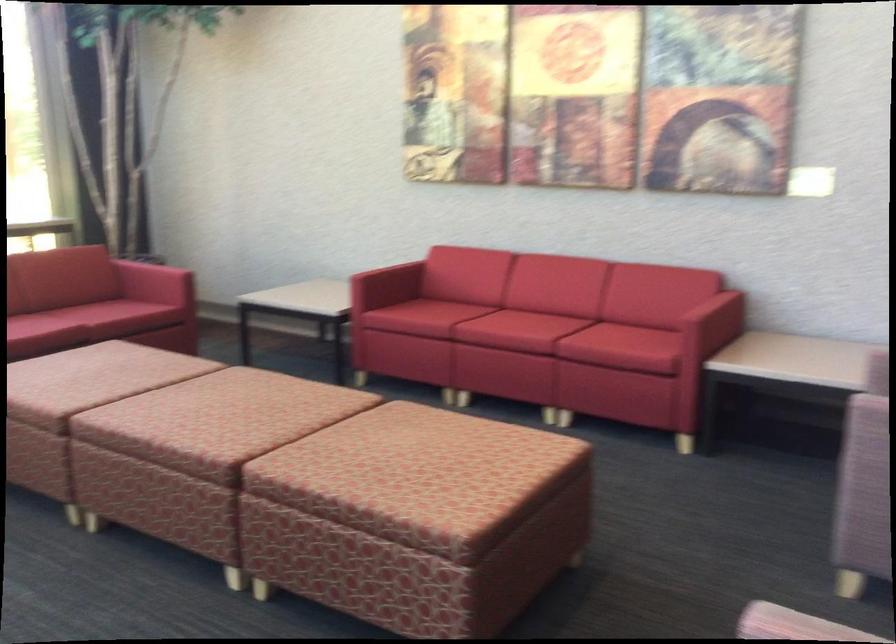
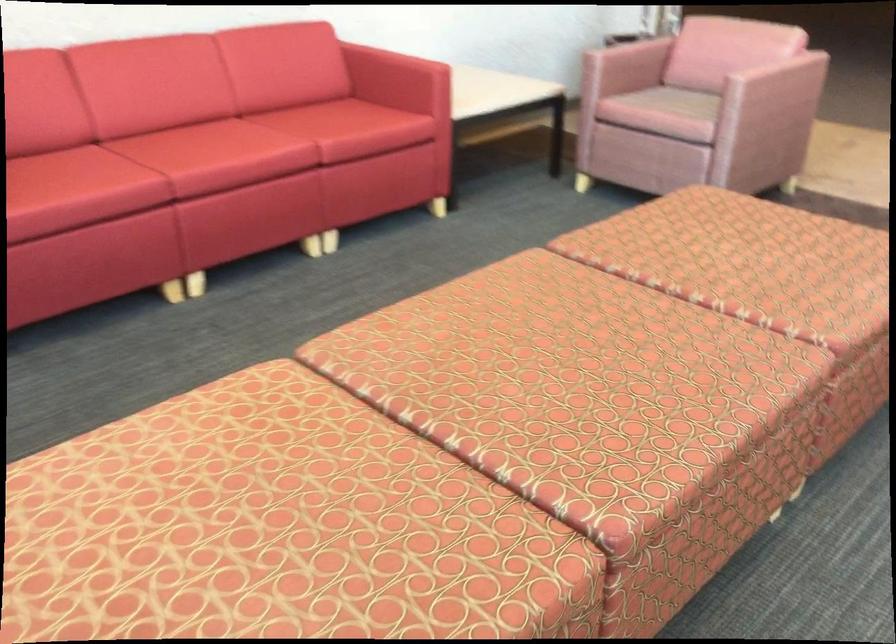
Locate, in the second image, the point that corresponds to point (449, 458) in the first image.

(762, 245)